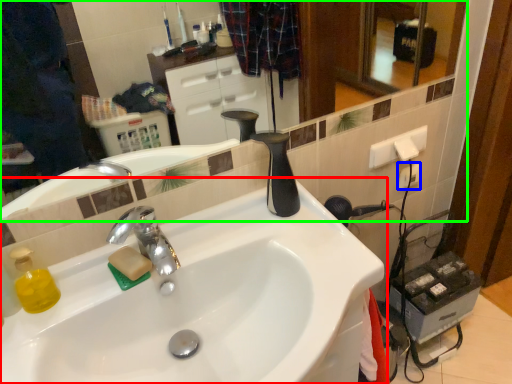
Question: Considering the real-world distances, which object is closest to sink (highlighted by a red box)? electric outlet (highlighted by a blue box) or mirror (highlighted by a green box).

Choices:
 (A) electric outlet
 (B) mirror

Answer: (A)